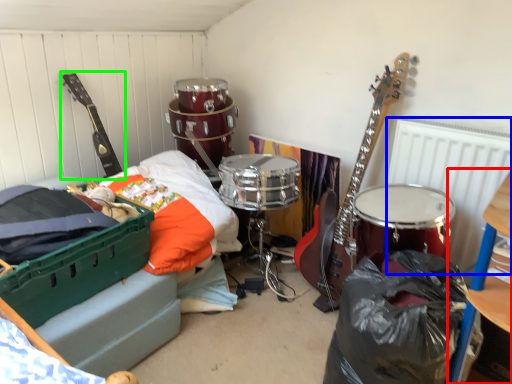
Question: Which is farther away from furniture (highlighted by a red box)? radiator (highlighted by a blue box) or guitar (highlighted by a green box)?

Choices:
 (A) radiator
 (B) guitar

Answer: (B)